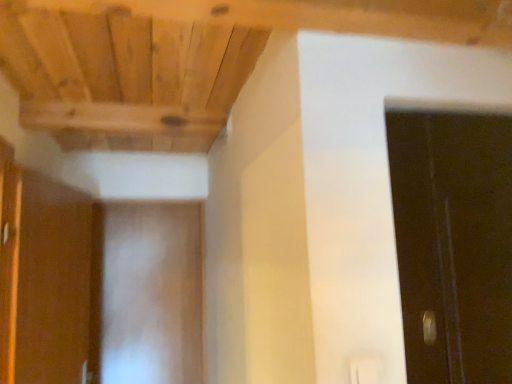
The width and height of the screenshot is (512, 384). What do you see at coordinates (152, 293) in the screenshot?
I see `white matte door at center` at bounding box center [152, 293].

This screenshot has width=512, height=384. I want to click on white matte door at center, so click(x=152, y=293).

Measure the distance between point (170, 237) and camera.

Point (170, 237) and camera are 9.22 feet apart.

The image size is (512, 384). What do you see at coordinates (45, 276) in the screenshot? I see `brown wood cabinet at left` at bounding box center [45, 276].

Where is `brown wood cabinet at left`? brown wood cabinet at left is located at coordinates (45, 276).

In the scene shown: In order to face brown wood cabinet at left, should I rotate leftwards or rightwards?

Turn left by 24.773 degrees to look at brown wood cabinet at left.

Where is `white matte door at center`? white matte door at center is located at coordinates (152, 293).

Which is more to the left, white matte door at center or brown wood cabinet at left?

brown wood cabinet at left.

Is the position of white matte door at center more distant than that of brown wood cabinet at left?

Yes, white matte door at center is behind brown wood cabinet at left.

Is point (141, 258) more distant than point (1, 255)?

Yes, it is behind point (1, 255).

From the picture: From the image's perspective, which is below, white matte door at center or brown wood cabinet at left?

white matte door at center.

From a real-world perspective, is white matte door at center located higher than brown wood cabinet at left?

No, from a real-world perspective, white matte door at center is not on top of brown wood cabinet at left.

In terms of width, does white matte door at center look wider or thinner when compared to brown wood cabinet at left?

In the image, white matte door at center appears to be more narrow than brown wood cabinet at left.

In terms of height, does white matte door at center look taller or shorter compared to brown wood cabinet at left?

Clearly, white matte door at center is taller compared to brown wood cabinet at left.

Between white matte door at center and brown wood cabinet at left, which one has smaller size?

With smaller size is white matte door at center.

In the scene shown: Is brown wood cabinet at left inside white matte door at center?

Definitely not — brown wood cabinet at left is not inside white matte door at center.

Are white matte door at center and brown wood cabinet at left making contact?

No, white matte door at center is not making contact with brown wood cabinet at left.

Looking at this image, is white matte door at center turned away from brown wood cabinet at left?

No.

What's the angular difference between white matte door at center and brown wood cabinet at left's facing directions?

77.4 degrees separate the facing orientations of white matte door at center and brown wood cabinet at left.

At what (x,y) coordinates should I click in order to perform the action: click on cabinetry on the left of white matte door at center. Please return your answer as a coordinate pair (x, y). The height and width of the screenshot is (384, 512). Looking at the image, I should click on (45, 276).

Between brown wood cabinet at left and white matte door at center, which one appears on the left side from the viewer's perspective?

brown wood cabinet at left is more to the left.

Between brown wood cabinet at left and white matte door at center, which one is positioned behind?

white matte door at center is further away from the camera.

Does point (33, 342) come in front of point (149, 301)?

Yes, it is.

From the image's perspective, between brown wood cabinet at left and white matte door at center, which one is located above?

brown wood cabinet at left appears higher in the image.

From a real-world perspective, is brown wood cabinet at left below white matte door at center?

No, from a real-world perspective, brown wood cabinet at left is not beneath white matte door at center.

Can you confirm if brown wood cabinet at left is thinner than white matte door at center?

In fact, brown wood cabinet at left might be wider than white matte door at center.

Based on the photo, can you confirm if brown wood cabinet at left is taller than white matte door at center?

In fact, brown wood cabinet at left may be shorter than white matte door at center.

Between brown wood cabinet at left and white matte door at center, which one has larger size?

Bigger between the two is brown wood cabinet at left.

Is brown wood cabinet at left inside the boundaries of white matte door at center, or outside?

brown wood cabinet at left is not enclosed by white matte door at center.

Would you consider brown wood cabinet at left to be distant from white matte door at center?

Actually, brown wood cabinet at left and white matte door at center are a little close together.

Is brown wood cabinet at left oriented away from white matte door at center?

No, white matte door at center is not at the back of brown wood cabinet at left.

Where is `door located on the right of brown wood cabinet at left`? door located on the right of brown wood cabinet at left is located at coordinates (152, 293).

The height and width of the screenshot is (384, 512). In the image, there is a brown wood cabinet at left. In order to click on door below it (from the image's perspective) in this screenshot , I will do `click(152, 293)`.

This screenshot has height=384, width=512. I want to click on cabinetry in front of the white matte door at center, so click(x=45, y=276).